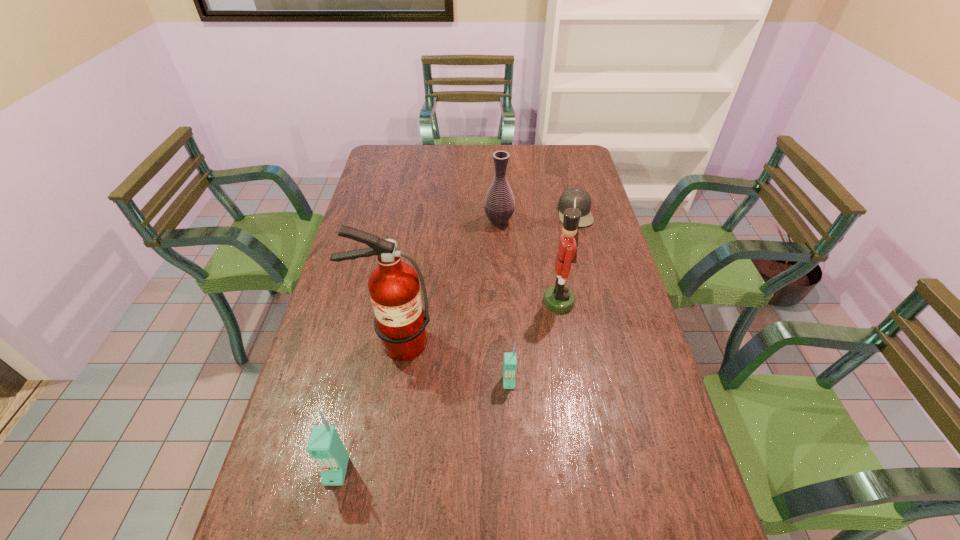
Find the location of a particular element. The image size is (960, 540). vacant space situated 0.150m on the keypad of the fifth tallest object is located at coordinates (513, 447).

The height and width of the screenshot is (540, 960). Identify the location of free location located on the back of the third tallest object. (498, 203).

Image resolution: width=960 pixels, height=540 pixels. In order to click on vacant space situated 0.370m on the nozzle and handle of the fire extinguisher in this screenshot , I will do `click(367, 512)`.

Identify the location of vacant space located 0.170m on the brim of the cap. The image size is (960, 540). (514, 213).

The image size is (960, 540). I want to click on vacant space located 0.090m on the brim of the cap, so pos(535,213).

I want to click on vacant space situated 0.110m on the brim of the cap, so click(x=529, y=213).

The image size is (960, 540). Identify the location of vacant space positioned 0.190m on the front-facing side of the fourth nearest object. (481, 302).

Find the location of a particular element. The width and height of the screenshot is (960, 540). free space located on the front-facing side of the fourth nearest object is located at coordinates (497, 302).

Where is `blank space located 0.150m on the front-facing side of the fourth nearest object`? This screenshot has height=540, width=960. blank space located 0.150m on the front-facing side of the fourth nearest object is located at coordinates (494, 302).

Find the location of `cellular telephone at the left edge`. cellular telephone at the left edge is located at coordinates (324, 445).